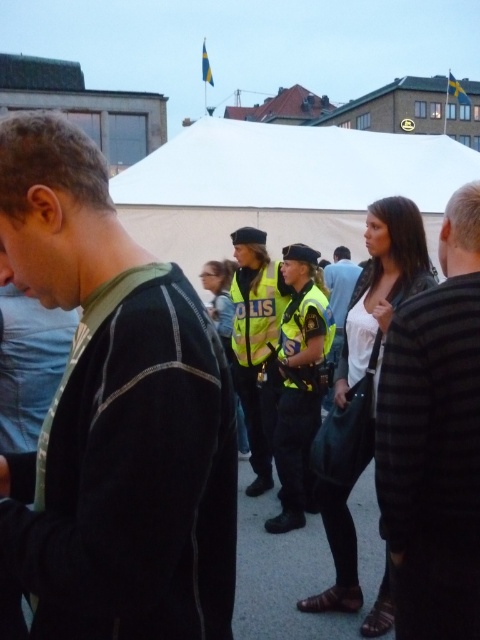
You are a photographer at the event and want to capture a clear shot of the striped fabric jacket at center without the reflective yellow vest at center blocking it. Is this possible based on their positions?

Result: Yes, since the striped fabric jacket at center is above the reflective yellow vest at center, you can adjust your angle or zoom to focus on the jacket without the vest blocking the view.